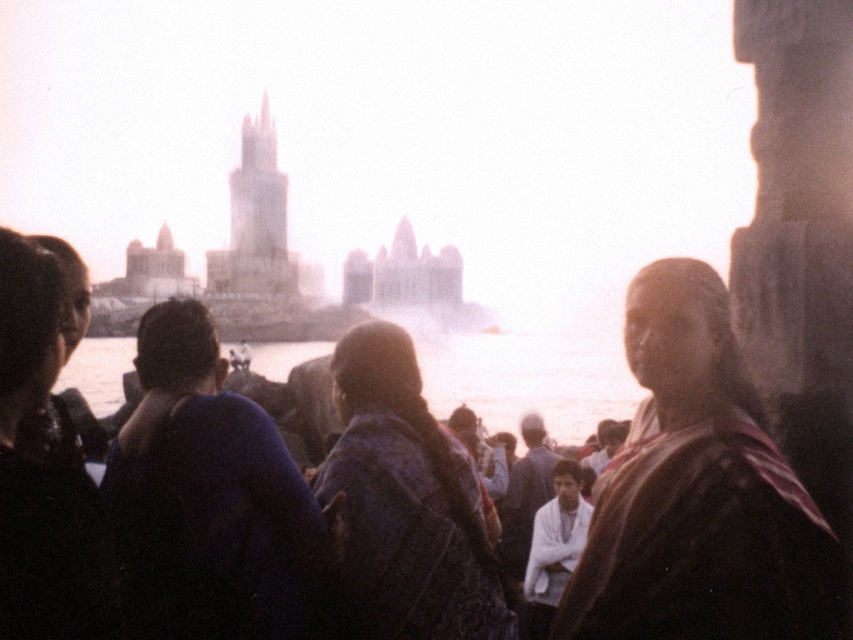
Question: Can you confirm if dark brown fabric at right is positioned above clear water at center?

Choices:
 (A) no
 (B) yes

Answer: (A)

Question: Does black fabric at left have a lesser width compared to white cotton shirt at center?

Choices:
 (A) yes
 (B) no

Answer: (B)

Question: Which of these objects is positioned closest to the white cotton shirt at center?

Choices:
 (A) patterned fabric scarf at center
 (B) black fabric at left
 (C) dark blue sweater at center
 (D) clear water at center

Answer: (A)

Question: Which point appears closest to the camera in this image?

Choices:
 (A) (171, 538)
 (B) (424, 536)
 (C) (606, 508)

Answer: (A)

Question: Among these objects, which one is nearest to the camera?

Choices:
 (A) dark brown fabric at right
 (B) clear water at center
 (C) black fabric at left

Answer: (C)

Question: Can you confirm if dark blue sweater at center is wider than white cotton shirt at center?

Choices:
 (A) yes
 (B) no

Answer: (A)